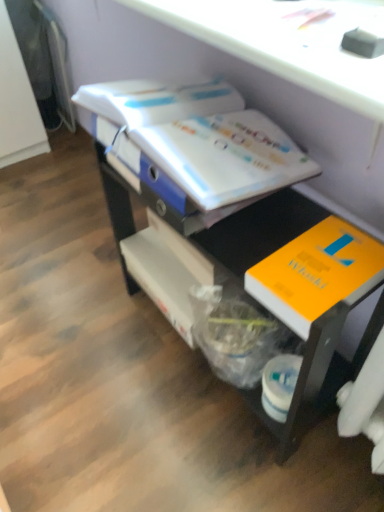
The width and height of the screenshot is (384, 512). I want to click on free space to the left of matte black drawer at center, so click(x=84, y=351).